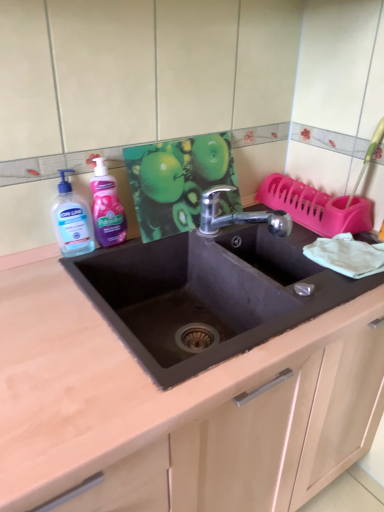
Question: Is transparent liquid soap at left, positioned as the 2th cleaning product in right-to-left order, far away from black matte sink at center?

Choices:
 (A) yes
 (B) no

Answer: (B)

Question: From the image's perspective, is transparent liquid soap at left, acting as the first cleaning product starting from the left, above black matte sink at center?

Choices:
 (A) yes
 (B) no

Answer: (A)

Question: Does transparent liquid soap at left, positioned as the 2th cleaning product in right-to-left order, have a greater width compared to black matte sink at center?

Choices:
 (A) no
 (B) yes

Answer: (A)

Question: From a real-world perspective, is transparent liquid soap at left, positioned as the 2th cleaning product in right-to-left order, positioned under black matte sink at center based on gravity?

Choices:
 (A) yes
 (B) no

Answer: (B)

Question: Is transparent liquid soap at left, positioned as the 2th cleaning product in right-to-left order, completely or partially outside of black matte sink at center?

Choices:
 (A) no
 (B) yes

Answer: (B)

Question: From the image's perspective, is pink glossy liquid soap at left, the 1th cleaning product from the right, positioned above or below black matte sink at center?

Choices:
 (A) above
 (B) below

Answer: (A)

Question: Considering their positions, is pink glossy liquid soap at left, the 1th cleaning product from the right, located in front of or behind black matte sink at center?

Choices:
 (A) front
 (B) behind

Answer: (B)

Question: Is point (97, 170) positioned closer to the camera than point (289, 229)?

Choices:
 (A) farther
 (B) closer

Answer: (B)

Question: Visually, is pink glossy liquid soap at left, the 2th cleaning product positioned from the left, positioned to the left or to the right of black matte sink at center?

Choices:
 (A) right
 (B) left

Answer: (B)

Question: In terms of height, does black matte sink at center look taller or shorter compared to pink glossy liquid soap at left, the 2th cleaning product positioned from the left?

Choices:
 (A) short
 (B) tall

Answer: (B)

Question: Considering their positions, is black matte sink at center located in front of or behind pink glossy liquid soap at left, the 2th cleaning product positioned from the left?

Choices:
 (A) front
 (B) behind

Answer: (A)

Question: Is point (132, 386) closer or farther from the camera than point (114, 184)?

Choices:
 (A) closer
 (B) farther

Answer: (A)

Question: From a real-world perspective, is black matte sink at center above or below pink glossy liquid soap at left, the 2th cleaning product positioned from the left?

Choices:
 (A) above
 (B) below

Answer: (B)

Question: From a real-world perspective, is transparent liquid soap at left, acting as the first cleaning product starting from the left, above or below pink glossy liquid soap at left, the 2th cleaning product positioned from the left?

Choices:
 (A) above
 (B) below

Answer: (B)

Question: From the image's perspective, is transparent liquid soap at left, acting as the first cleaning product starting from the left, located above or below pink glossy liquid soap at left, the 1th cleaning product from the right?

Choices:
 (A) below
 (B) above

Answer: (A)